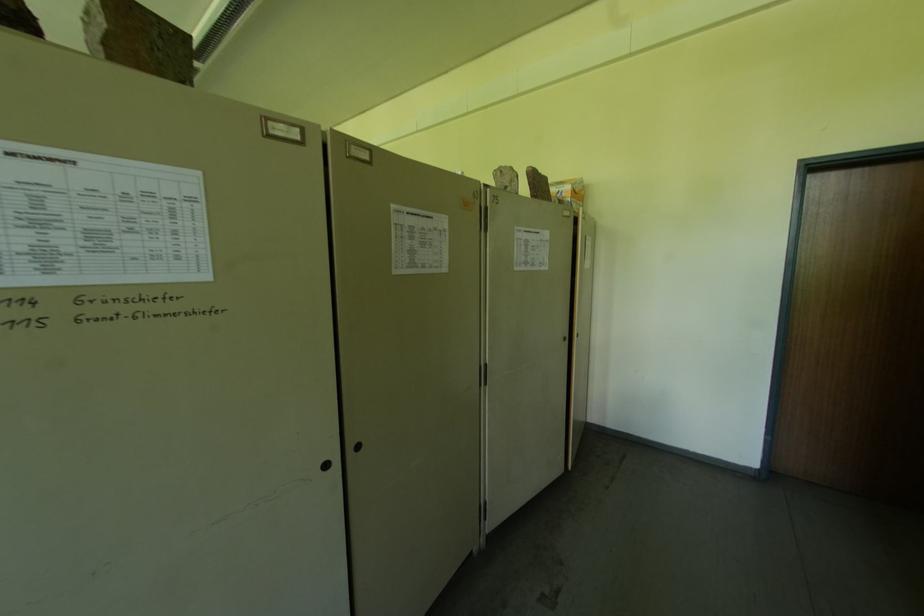
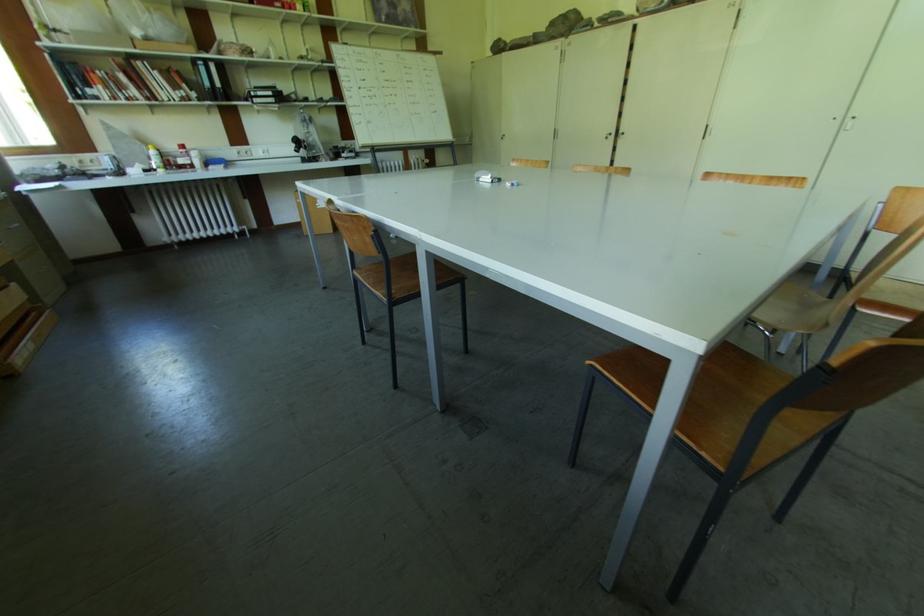
The images are taken continuously from a first-person perspective. In which direction are you moving?

The cameraman moved toward left, forward.